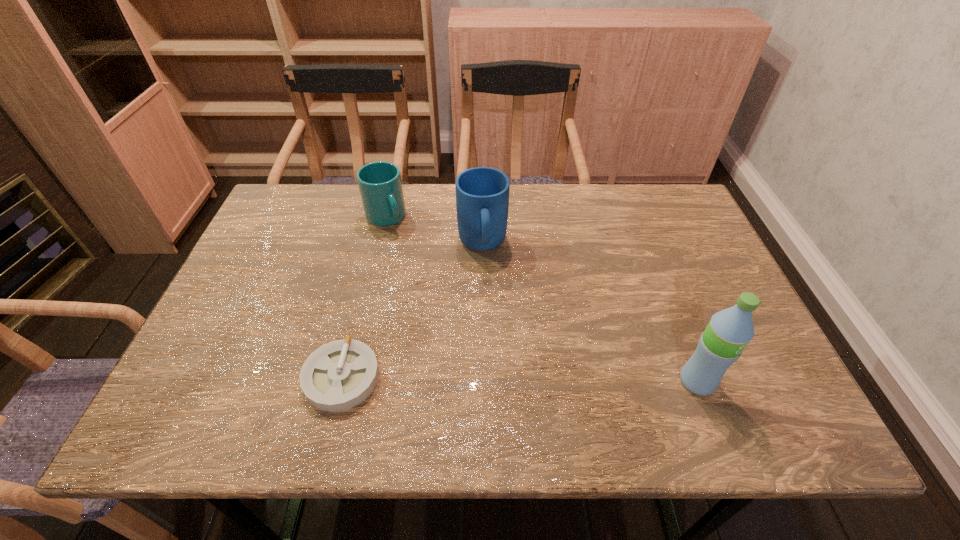
Identify the location of free space on the desktop that is between the shortest object and the tallest object and is positioned on the side of the second tallest object with the handle. The width and height of the screenshot is (960, 540). (496, 379).

Where is `free space on the desktop that is between the shortest object and the tallest object and is positioned on the handle side of the second shortest object`? free space on the desktop that is between the shortest object and the tallest object and is positioned on the handle side of the second shortest object is located at coordinates (509, 380).